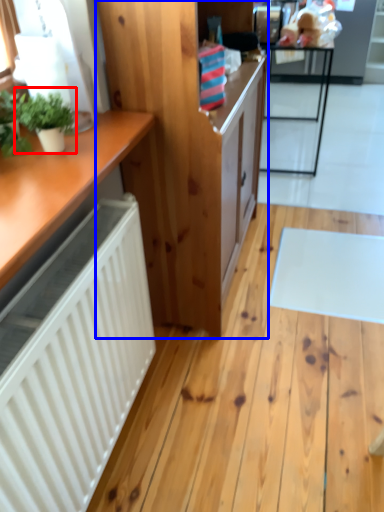
Question: Which of the following is the closest to the observer, houseplant (highlighted by a red box) or cabinetry (highlighted by a blue box)?

Choices:
 (A) houseplant
 (B) cabinetry

Answer: (A)